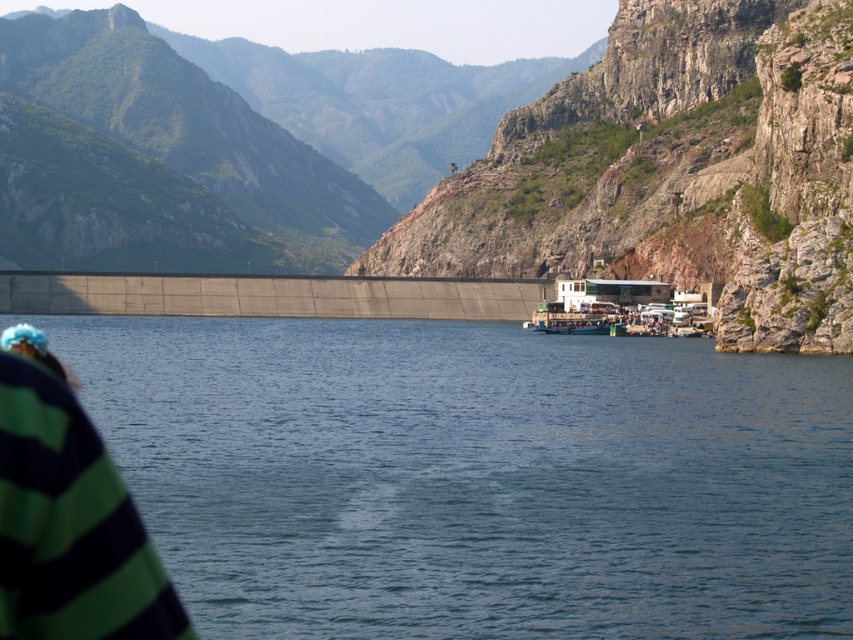
Which is in front, point (462, 253) or point (30, 595)?

Positioned in front is point (30, 595).

Which is behind, point (119, 129) or point (6, 440)?

Positioned behind is point (119, 129).

Image resolution: width=853 pixels, height=640 pixels. What are the coordinates of `rocky cliff at upper right` in the screenshot? It's located at (515, 172).

Who is taller, rocky cliff at upper right or white matte boat at center?

rocky cliff at upper right

Is rocky cliff at upper right positioned at the back of white matte boat at center?

No, rocky cliff at upper right is closer to the viewer.

Does point (637, 124) come behind point (604, 289)?

That is True.

Where is `rocky cliff at upper right`? This screenshot has height=640, width=853. rocky cliff at upper right is located at coordinates (515, 172).

Between blue water at center and rocky cliff at upper right, which one is positioned higher?

rocky cliff at upper right is above.

Identify the location of blue water at center. The image size is (853, 640). (474, 476).